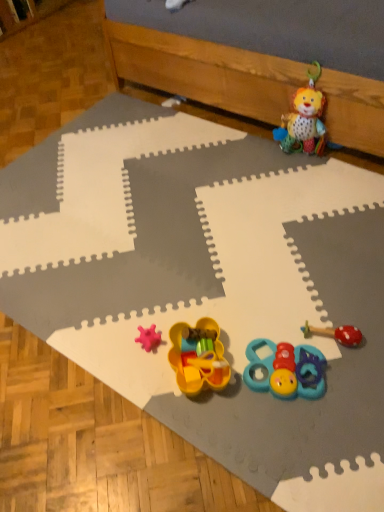
Locate an element on the screen. This screenshot has width=384, height=512. vacant space that's between plush fabric lion at upper right, the 4th toy in the front-to-back sequence, and red rubber teething ring at lower right, which is the 2th toy in back-to-front order is located at coordinates (313, 228).